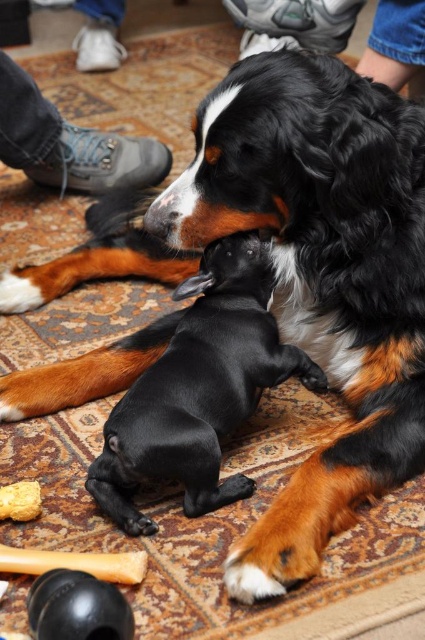
Does black smooth puppy at center have a smaller size compared to jeans at upper center?

Incorrect, black smooth puppy at center is not smaller in size than jeans at upper center.

Which is in front, point (116, 448) or point (388, 44)?

Point (116, 448)

Find the location of a particular element. black smooth puppy at center is located at coordinates pyautogui.click(x=198, y=388).

Is point (47, 604) closer to camera compared to point (33, 516)?

That is True.

Which of these two, black rubber ball at lower left or smooth yellow rubber toy at lower left, stands shorter?

smooth yellow rubber toy at lower left

Who is more distant from viewer, (53,595) or (36,490)?

The point (36,490) is behind.

Where is `black rubber ball at lower left`? The image size is (425, 640). black rubber ball at lower left is located at coordinates (78, 608).

Is black smooth puppy at center above leather shoe at upper left?

No, black smooth puppy at center is not above leather shoe at upper left.

This screenshot has width=425, height=640. In order to click on black smooth puppy at center in this screenshot , I will do `click(198, 388)`.